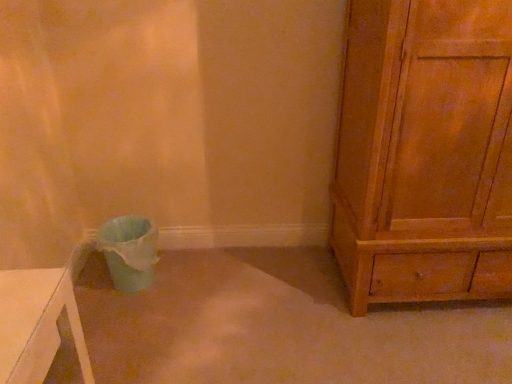
The width and height of the screenshot is (512, 384). What do you see at coordinates (425, 152) in the screenshot?
I see `wooden chest of drawers at right` at bounding box center [425, 152].

Find the location of a particular element. This screenshot has width=512, height=384. wooden chest of drawers at right is located at coordinates (425, 152).

What do you see at coordinates (129, 251) in the screenshot? Image resolution: width=512 pixels, height=384 pixels. I see `matte plastic potty at lower left` at bounding box center [129, 251].

Find the location of a particular element. The width and height of the screenshot is (512, 384). matte plastic potty at lower left is located at coordinates (129, 251).

You are a GUI agent. You are given a task and a screenshot of the screen. Output one action in this format:
    pyautogui.click(x=<x>, y=<y>)
    Task: Click on the wooden chest of drawers at right
    The width and height of the screenshot is (512, 384).
    Given the screenshot: What is the action you would take?
    pyautogui.click(x=425, y=152)

Which object is positioned more to the right, wooden chest of drawers at right or matte plastic potty at lower left?

wooden chest of drawers at right is more to the right.

Who is more distant, wooden chest of drawers at right or matte plastic potty at lower left?

matte plastic potty at lower left.

Does point (385, 0) come in front of point (102, 247)?

Yes, it is in front of point (102, 247).

From the image's perspective, is wooden chest of drawers at right on top of matte plastic potty at lower left?

Yes.

From a real-world perspective, is wooden chest of drawers at right positioned above or below matte plastic potty at lower left?

wooden chest of drawers at right is above matte plastic potty at lower left.

Between wooden chest of drawers at right and matte plastic potty at lower left, which one has larger width?

With larger width is wooden chest of drawers at right.

Based on the photo, between wooden chest of drawers at right and matte plastic potty at lower left, which one has more height?

With more height is wooden chest of drawers at right.

In the scene shown: Who is bigger, wooden chest of drawers at right or matte plastic potty at lower left?

Bigger between the two is wooden chest of drawers at right.

Is wooden chest of drawers at right inside or outside of matte plastic potty at lower left?

wooden chest of drawers at right exists outside the volume of matte plastic potty at lower left.

Are wooden chest of drawers at right and matte plastic potty at lower left far apart?

That's right, there is a large distance between wooden chest of drawers at right and matte plastic potty at lower left.

Is matte plastic potty at lower left at the back of wooden chest of drawers at right?

That's not correct — wooden chest of drawers at right is not looking away from matte plastic potty at lower left.

You are a GUI agent. You are given a task and a screenshot of the screen. Output one action in this format:
    pyautogui.click(x=<x>, y=<y>)
    Task: Click on the potty that appears behind the wooden chest of drawers at right
    Image resolution: width=512 pixels, height=384 pixels.
    Given the screenshot: What is the action you would take?
    pyautogui.click(x=129, y=251)

Is matte plastic potty at lower left to the right of wooden chest of drawers at right from the viewer's perspective?

In fact, matte plastic potty at lower left is to the left of wooden chest of drawers at right.

Does matte plastic potty at lower left come in front of wooden chest of drawers at right?

No, matte plastic potty at lower left is further to the viewer.

Does point (139, 226) appear closer or farther from the camera than point (485, 65)?

Point (139, 226) appears to be farther away from the viewer than point (485, 65).

From the image's perspective, which is below, matte plastic potty at lower left or wooden chest of drawers at right?

matte plastic potty at lower left, from the image's perspective.

From a real-world perspective, which is physically below, matte plastic potty at lower left or wooden chest of drawers at right?

In real-world perspective, matte plastic potty at lower left is lower.

Considering the sizes of matte plastic potty at lower left and wooden chest of drawers at right in the image, is matte plastic potty at lower left wider or thinner than wooden chest of drawers at right?

In the image, matte plastic potty at lower left appears to be more narrow than wooden chest of drawers at right.

Considering the sizes of objects matte plastic potty at lower left and wooden chest of drawers at right in the image provided, who is taller, matte plastic potty at lower left or wooden chest of drawers at right?

Standing taller between the two is wooden chest of drawers at right.

Who is smaller, matte plastic potty at lower left or wooden chest of drawers at right?

matte plastic potty at lower left is smaller.

Is wooden chest of drawers at right located within matte plastic potty at lower left?

No, wooden chest of drawers at right is not surrounded by matte plastic potty at lower left.

Would you say matte plastic potty at lower left is a long distance from wooden chest of drawers at right?

matte plastic potty at lower left is positioned a significant distance from wooden chest of drawers at right.

In the scene shown: Is wooden chest of drawers at right at the back of matte plastic potty at lower left?

matte plastic potty at lower left does not have its back to wooden chest of drawers at right.

Can you tell me how much matte plastic potty at lower left and wooden chest of drawers at right differ in facing direction?

The angle between the facing direction of matte plastic potty at lower left and the facing direction of wooden chest of drawers at right is 0.966 degrees.

Identify the location of chest of drawers lying on the right of matte plastic potty at lower left. The image size is (512, 384). (425, 152).

Identify the location of the chest of drawers in front of the matte plastic potty at lower left. The width and height of the screenshot is (512, 384). (425, 152).

Image resolution: width=512 pixels, height=384 pixels. In order to click on potty below the wooden chest of drawers at right (from a real-world perspective) in this screenshot , I will do `click(129, 251)`.